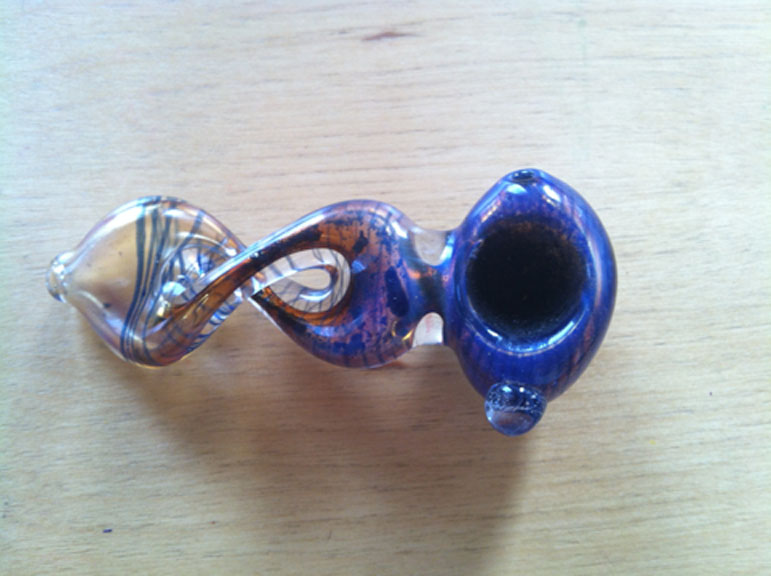
Find the location of a particular element. This screenshot has width=771, height=576. glass is located at coordinates (418, 282).